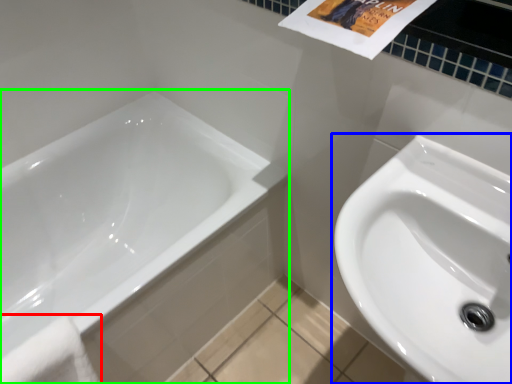
Question: Which object is the closest to the bath towel (highlighted by a red box)? Choose among these: sink (highlighted by a blue box) or bathtub (highlighted by a green box).

Choices:
 (A) sink
 (B) bathtub

Answer: (B)